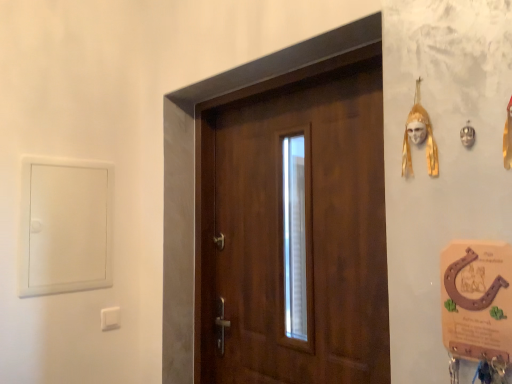
Describe the element at coordinates (305, 233) in the screenshot. Image resolution: width=512 pixels, height=384 pixels. I see `wooden door at center` at that location.

In order to face gold metallic mask at upper right, should I rotate leftwards or rightwards?

You should look right and rotate roughly 20.642 degrees.

Locate an element on the screen. Image resolution: width=512 pixels, height=384 pixels. wooden door at center is located at coordinates (305, 233).

Are white plastic light switch at lower left and gold metallic mask at upper right located far from each other?

Yes, white plastic light switch at lower left and gold metallic mask at upper right are located far from each other.

How many degrees apart are the facing directions of white plastic light switch at lower left and gold metallic mask at upper right?

The facing directions of white plastic light switch at lower left and gold metallic mask at upper right are 89.4 degrees apart.

Who is shorter, white plastic light switch at lower left or gold metallic mask at upper right?

Standing shorter between the two is white plastic light switch at lower left.

From a real-world perspective, which is physically above, white plastic light switch at lower left or gold metallic mask at upper right?

In real-world perspective, gold metallic mask at upper right is above.

Can you tell me how much gold metallic mask at upper right and white plastic light switch at lower left differ in facing direction?

The angular difference between gold metallic mask at upper right and white plastic light switch at lower left is 89.4 degrees.

Is gold metallic mask at upper right looking in the opposite direction of white plastic light switch at lower left?

No, gold metallic mask at upper right is not facing away from white plastic light switch at lower left.

From a real-world perspective, is gold metallic mask at upper right beneath white plastic light switch at lower left?

No, from a real-world perspective, gold metallic mask at upper right is not below white plastic light switch at lower left.

Is gold metallic mask at upper right positioned in front of white plastic light switch at lower left?

Yes, it is in front of white plastic light switch at lower left.

Does white plastic light switch at lower left have a larger size compared to wooden door at center?

No, white plastic light switch at lower left is not bigger than wooden door at center.

Which is correct: white plastic light switch at lower left is inside wooden door at center, or outside of it?

white plastic light switch at lower left is located beyond the bounds of wooden door at center.

Can you confirm if white plastic light switch at lower left is wider than wooden door at center?

In fact, white plastic light switch at lower left might be narrower than wooden door at center.

Identify the location of decor above the wooden door at center (from a real-world perspective). (419, 137).

Considering the relative sizes of wooden door at center and gold metallic mask at upper right in the image provided, is wooden door at center bigger than gold metallic mask at upper right?

Yes, wooden door at center is bigger than gold metallic mask at upper right.

Would you say wooden door at center is to the left or to the right of gold metallic mask at upper right in the picture?

Clearly, wooden door at center is on the left of gold metallic mask at upper right in the image.

Could you tell me if wooden door at center is facing gold metallic mask at upper right?

No, wooden door at center is not turned towards gold metallic mask at upper right.

From the image's perspective, is gold metallic mask at upper right positioned above or below wooden door at center?

Clearly, from the image's perspective, gold metallic mask at upper right is above wooden door at center.

Is gold metallic mask at upper right in front of or behind wooden door at center in the image?

gold metallic mask at upper right is positioned closer to the viewer than wooden door at center.

Considering the sizes of gold metallic mask at upper right and wooden door at center in the image, is gold metallic mask at upper right taller or shorter than wooden door at center?

Considering their sizes, gold metallic mask at upper right has less height than wooden door at center.

At what (x,y) coordinates should I click in order to perform the action: click on door below the gold metallic mask at upper right (from a real-world perspective). Please return your answer as a coordinate pair (x, y). Looking at the image, I should click on (305, 233).

Between wooden door at center and white plastic light switch at lower left, which one has larger size?

Bigger between the two is wooden door at center.

Looking at this image, in the image, is wooden door at center positioned in front of or behind white plastic light switch at lower left?

Visually, wooden door at center is located in front of white plastic light switch at lower left.

Image resolution: width=512 pixels, height=384 pixels. What are the coordinates of `door on the right side of white plastic light switch at lower left` in the screenshot? It's located at (305, 233).

Are wooden door at center and white plastic light switch at lower left far apart?

Actually, wooden door at center and white plastic light switch at lower left are a little close together.

This screenshot has height=384, width=512. Identify the location of decor in front of the white plastic light switch at lower left. (419, 137).

Find the location of a particular element. The image size is (512, 384). light switch located behind the gold metallic mask at upper right is located at coordinates (110, 318).

From the image, which object appears to be farther from wooden door at center, gold metallic mask at upper right or white plastic light switch at lower left?

white plastic light switch at lower left lies further to wooden door at center than the other object.

Based on their spatial positions, is wooden door at center or white plastic light switch at lower left closer to gold metallic mask at upper right?

wooden door at center.

From the image, which object appears to be nearer to wooden door at center, white plastic light switch at lower left or gold metallic mask at upper right?

Among the two, gold metallic mask at upper right is located nearer to wooden door at center.

Considering their positions, is gold metallic mask at upper right positioned closer to white plastic light switch at lower left than wooden door at center?

wooden door at center.

Which object lies further to the anchor point white plastic light switch at lower left, wooden door at center or gold metallic mask at upper right?

gold metallic mask at upper right.

Which object lies nearer to the anchor point gold metallic mask at upper right, white plastic light switch at lower left or wooden door at center?

wooden door at center.

Where is `door between white plastic light switch at lower left and gold metallic mask at upper right in the horizontal direction`? Image resolution: width=512 pixels, height=384 pixels. door between white plastic light switch at lower left and gold metallic mask at upper right in the horizontal direction is located at coordinates (305, 233).